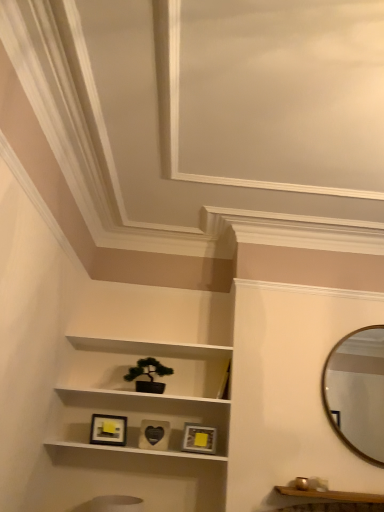
Question: Does wooden shelf at lower right appear on the left side of gold metallic mirror at upper right?

Choices:
 (A) yes
 (B) no

Answer: (A)

Question: Is the depth of wooden shelf at lower right greater than that of gold metallic mirror at upper right?

Choices:
 (A) yes
 (B) no

Answer: (B)

Question: Would you say wooden shelf at lower right is a long distance from gold metallic mirror at upper right?

Choices:
 (A) no
 (B) yes

Answer: (A)

Question: Does wooden shelf at lower right appear on the right side of gold metallic mirror at upper right?

Choices:
 (A) no
 (B) yes

Answer: (A)

Question: From the image's perspective, is wooden shelf at lower right above gold metallic mirror at upper right?

Choices:
 (A) yes
 (B) no

Answer: (B)

Question: From the image's perspective, relative to wooden shelf at lower right, is matte black picture frame at lower center, which is counted as the first picture frame, starting from the left, above or below?

Choices:
 (A) below
 (B) above

Answer: (B)

Question: Is matte black picture frame at lower center, marked as the 3th picture frame in a right-to-left arrangement, to the left or to the right of wooden shelf at lower right in the image?

Choices:
 (A) left
 (B) right

Answer: (A)

Question: Is matte black picture frame at lower center, marked as the 3th picture frame in a right-to-left arrangement, bigger or smaller than wooden shelf at lower right?

Choices:
 (A) small
 (B) big

Answer: (A)

Question: Is matte black picture frame at lower center, which is counted as the first picture frame, starting from the left, wider or thinner than wooden shelf at lower right?

Choices:
 (A) thin
 (B) wide

Answer: (A)

Question: Based on their sizes in the image, would you say matte gold picture frame at center, positioned as the first picture frame in right-to-left order, is bigger or smaller than black matte heart at center, which is counted as the second picture frame, starting from the right?

Choices:
 (A) small
 (B) big

Answer: (B)

Question: Do you think matte gold picture frame at center, which is counted as the 3th picture frame, starting from the left, is within black matte heart at center, the second picture frame viewed from the left, or outside of it?

Choices:
 (A) inside
 (B) outside

Answer: (B)

Question: Is matte gold picture frame at center, positioned as the first picture frame in right-to-left order, taller or shorter than black matte heart at center, the second picture frame viewed from the left?

Choices:
 (A) short
 (B) tall

Answer: (A)

Question: Is matte gold picture frame at center, positioned as the first picture frame in right-to-left order, wider or thinner than black matte heart at center, the second picture frame viewed from the left?

Choices:
 (A) wide
 (B) thin

Answer: (A)

Question: Is point (99, 431) positioned closer to the camera than point (211, 443)?

Choices:
 (A) farther
 (B) closer

Answer: (B)

Question: Choose the correct answer: Is matte black picture frame at lower center, which is counted as the first picture frame, starting from the left, inside matte gold picture frame at center, which is counted as the 3th picture frame, starting from the left, or outside it?

Choices:
 (A) inside
 (B) outside

Answer: (B)